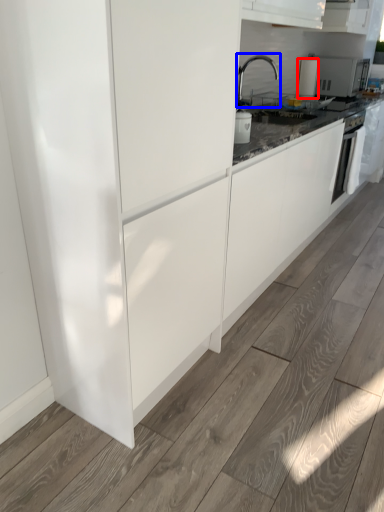
Question: Among these objects, which one is farthest to the camera, kitchen appliance (highlighted by a red box) or tap (highlighted by a blue box)?

Choices:
 (A) kitchen appliance
 (B) tap

Answer: (A)